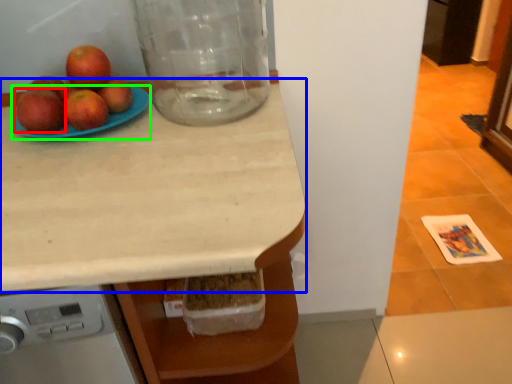
Question: Based on their relative distances, which object is farther from apple (highlighted by a red box)? Choose from countertop (highlighted by a blue box) and glass plate (highlighted by a green box).

Choices:
 (A) countertop
 (B) glass plate

Answer: (A)